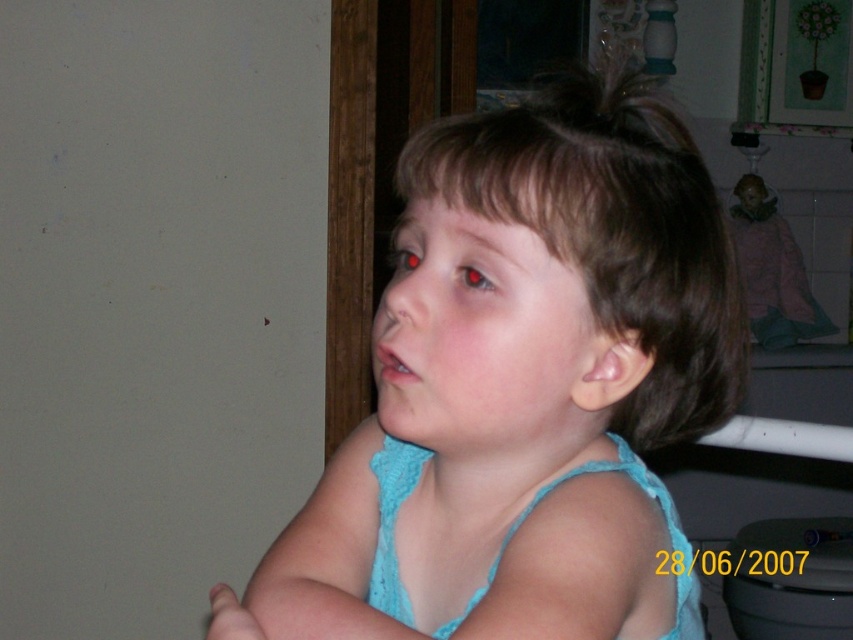
Question: Does light blue fabric at center appear on the left side of brown smooth hair at center?

Choices:
 (A) no
 (B) yes

Answer: (B)

Question: Which point is closer to the camera?

Choices:
 (A) (695, 278)
 (B) (512, 218)

Answer: (B)

Question: Is light blue fabric at center smaller than brown smooth hair at center?

Choices:
 (A) no
 (B) yes

Answer: (A)

Question: Where is light blue fabric at center located in relation to brown smooth hair at center in the image?

Choices:
 (A) above
 (B) below

Answer: (B)